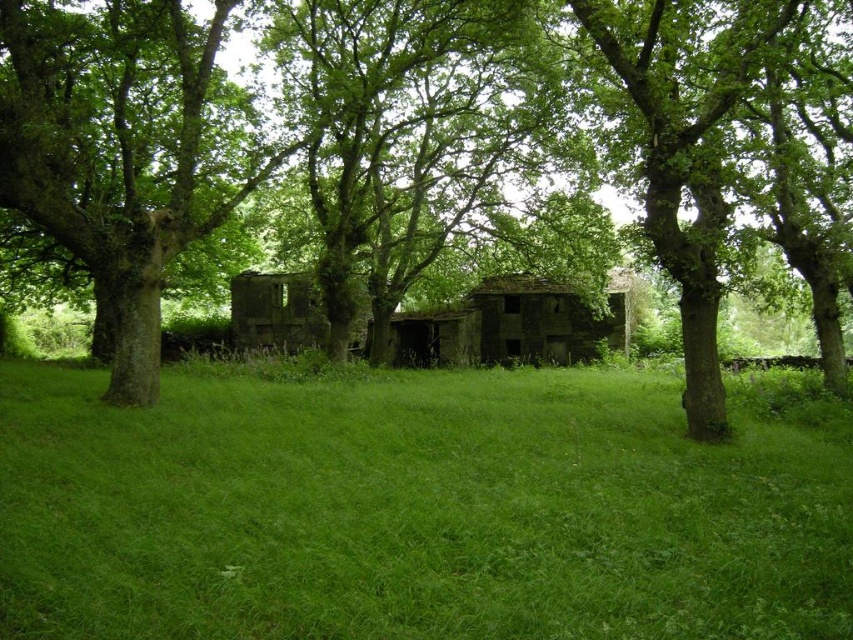
Question: Which object is farther from the camera taking this photo?

Choices:
 (A) green grassy field at center
 (B) green leafy tree at center

Answer: (B)

Question: Considering the relative positions of green leafy tree at center and green rough bark tree at left in the image provided, where is green leafy tree at center located with respect to green rough bark tree at left?

Choices:
 (A) left
 (B) right

Answer: (B)

Question: Which of the following is the farthest from the observer?

Choices:
 (A) (151, 248)
 (B) (111, 74)
 (C) (410, 396)

Answer: (B)

Question: Does green grassy field at center appear under green leafy tree at center?

Choices:
 (A) no
 (B) yes

Answer: (B)

Question: Does green grassy field at center have a greater width compared to green rough bark tree at left?

Choices:
 (A) yes
 (B) no

Answer: (A)

Question: Which of these objects is positioned farthest from the green leafy tree at center?

Choices:
 (A) green rough bark tree at left
 (B) green grassy field at center

Answer: (B)